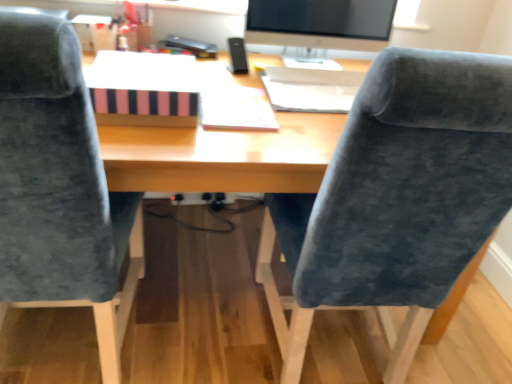
Find the location of `empty space that is ontop of pink striped paper at center, positioned as the first book in left-to-right order`. empty space that is ontop of pink striped paper at center, positioned as the first book in left-to-right order is located at coordinates (148, 67).